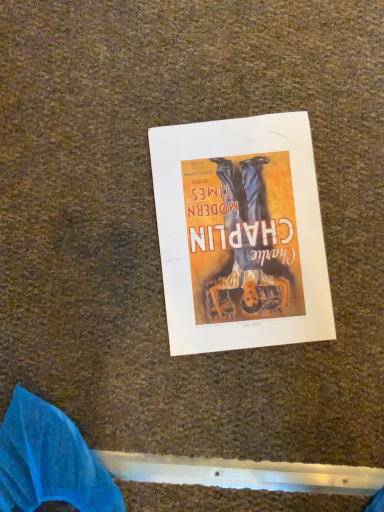
Identify the location of white paper poster at center. The width and height of the screenshot is (384, 512). (240, 234).

The width and height of the screenshot is (384, 512). What do you see at coordinates (240, 234) in the screenshot?
I see `white paper poster at center` at bounding box center [240, 234].

Where is `white paper poster at center`? The height and width of the screenshot is (512, 384). white paper poster at center is located at coordinates (240, 234).